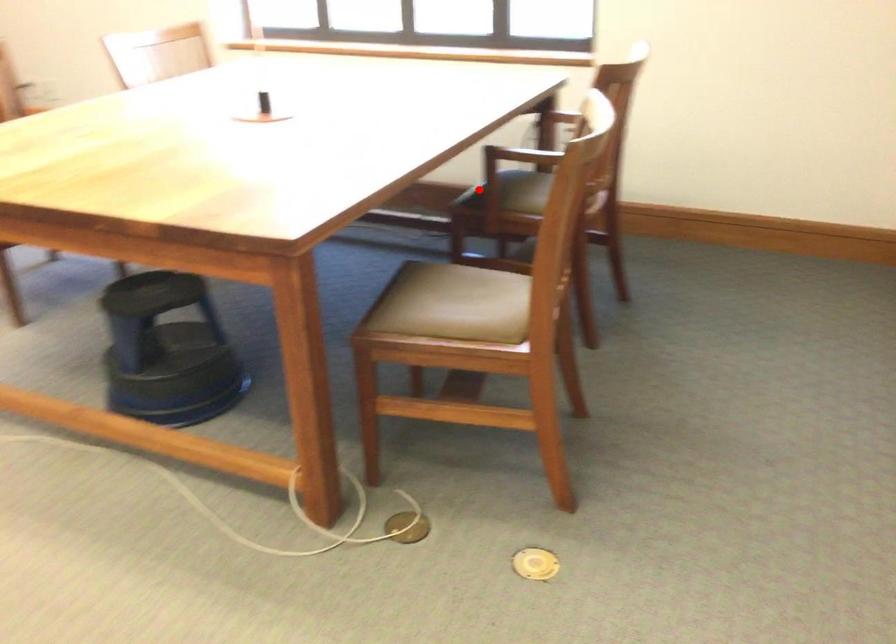
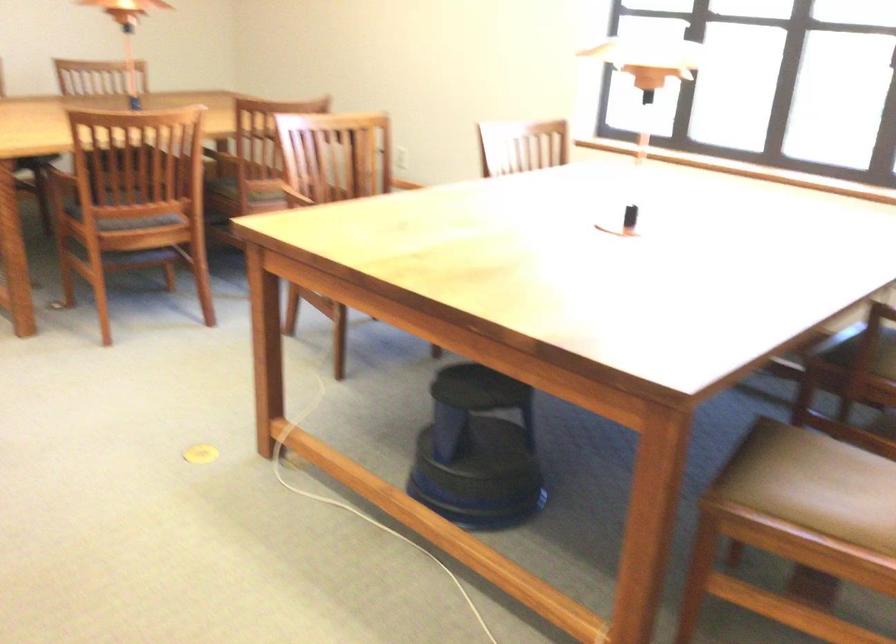
In the second image, find the point that corresponds to the highlighted location in the first image.

(851, 346)